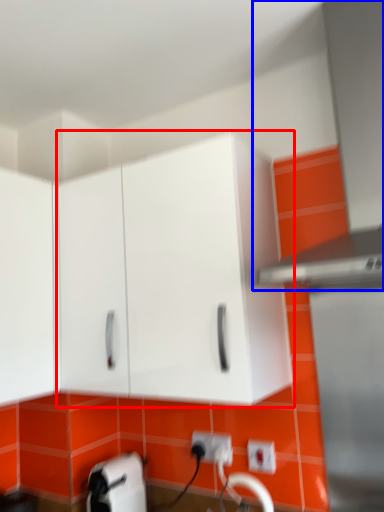
Question: Which object is further to the camera taking this photo, cabinetry (highlighted by a red box) or exhaust hood (highlighted by a blue box)?

Choices:
 (A) cabinetry
 (B) exhaust hood

Answer: (A)